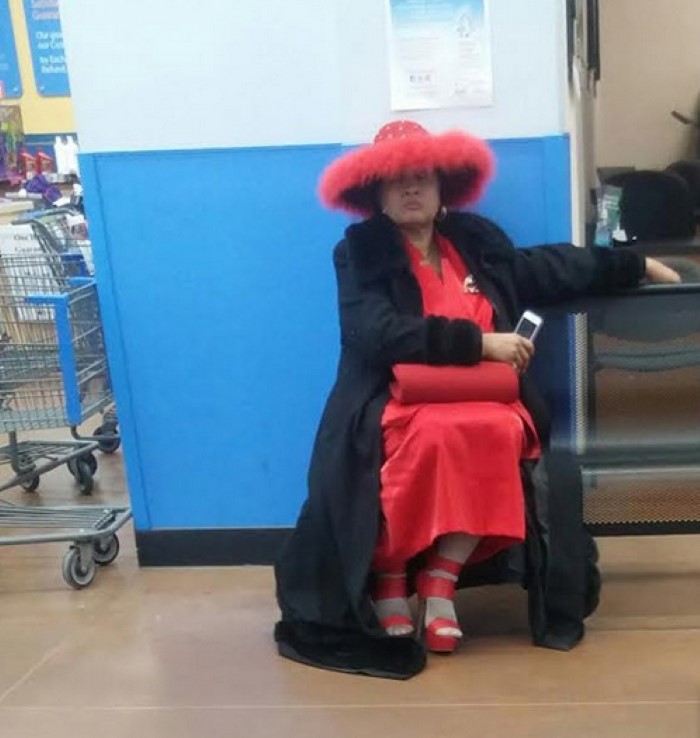
This screenshot has width=700, height=738. Find the location of `phone`. phone is located at coordinates (528, 331).